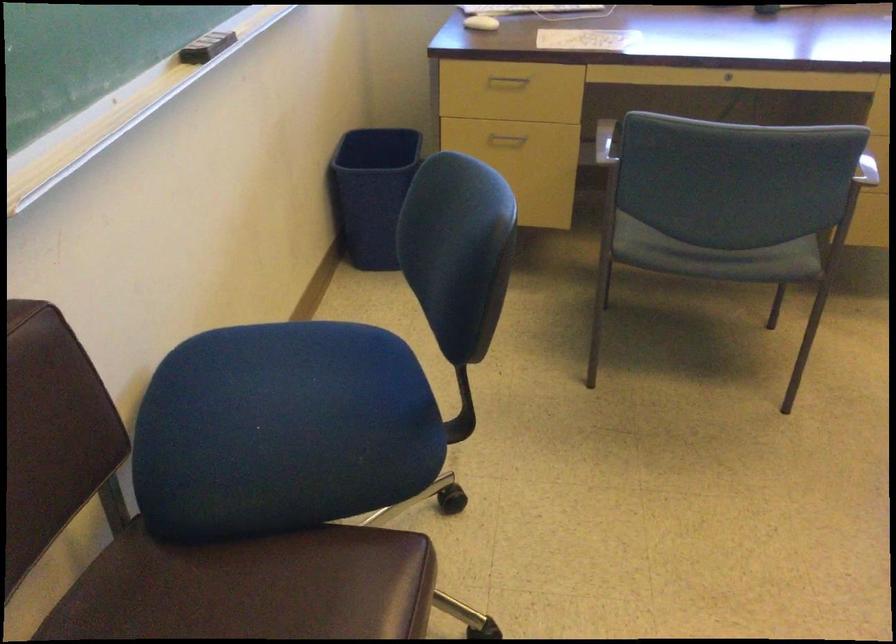
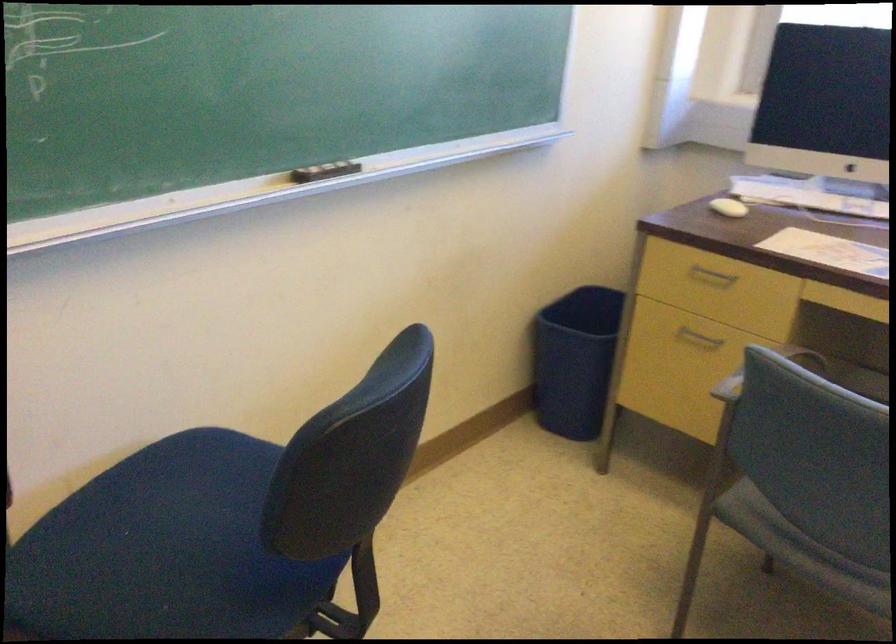
Locate, in the second image, the point that corresponds to (x=501, y=84) in the first image.

(711, 277)